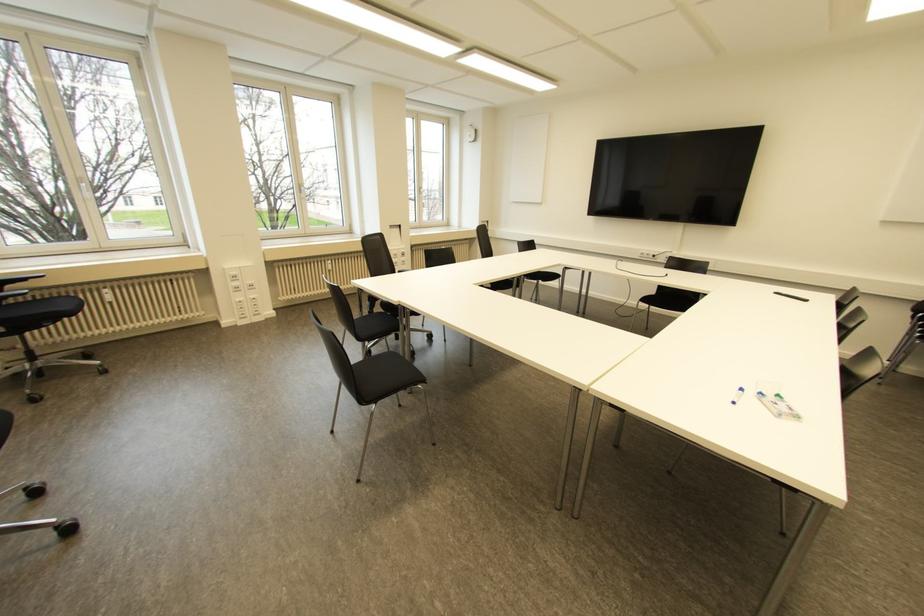
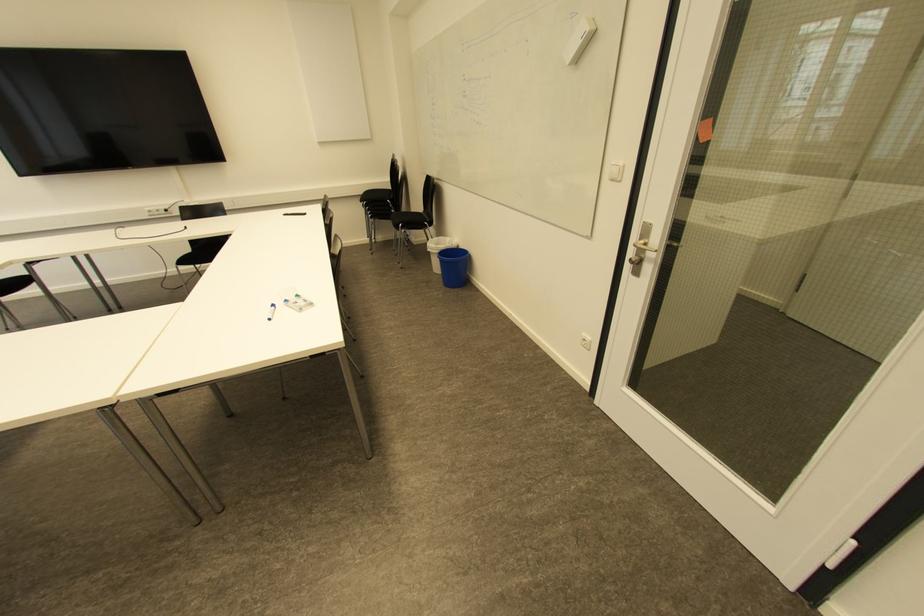
In the second image, find the point that corresponds to the point at 645,299 in the first image.

(183, 261)